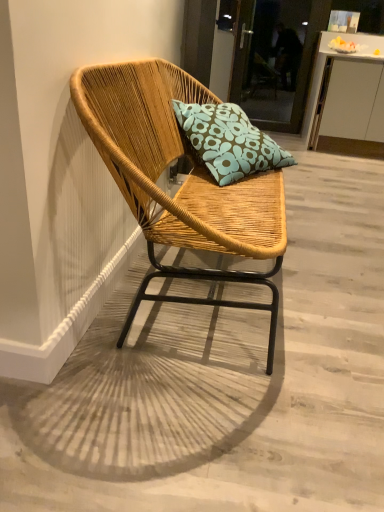
Question: Relative to teal floral cushion at center, is transparent glass door at upper center in front or behind?

Choices:
 (A) front
 (B) behind

Answer: (B)

Question: In terms of height, does transparent glass door at upper center look taller or shorter compared to teal floral cushion at center?

Choices:
 (A) short
 (B) tall

Answer: (B)

Question: Estimate the real-world distances between objects in this image. Which object is farther from the natural wood chair at center?

Choices:
 (A) white glossy cabinet at upper right
 (B) teal floral cushion at center
 (C) transparent glass door at upper center

Answer: (C)

Question: Considering the real-world distances, which object is farthest from the teal floral cushion at center?

Choices:
 (A) white glossy cabinet at upper right
 (B) transparent glass door at upper center
 (C) natural wood chair at center

Answer: (B)